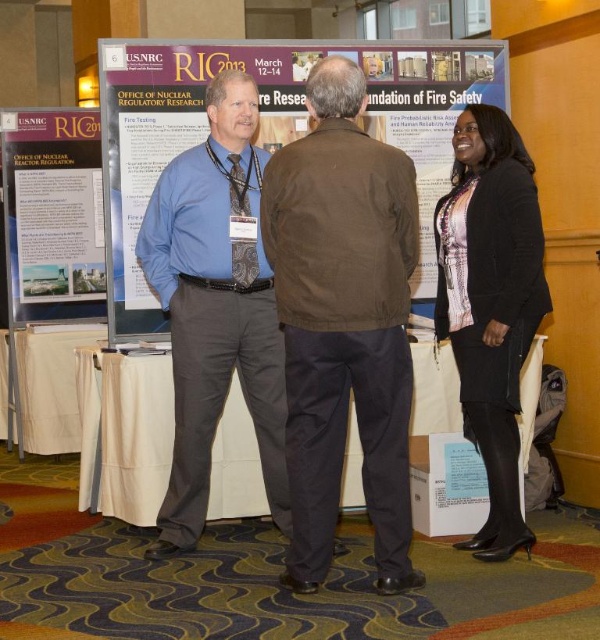
You are standing at the point labeled as point [208,380] in the conference room. You want to reach the exit door located at the opposite side of the room. Considering your height is 1.75 meters, will you be able to see the exit door over the heads of the three people in the foreground who are blocking your view?

The point labeled as point [208,380] is 3.68 meters away from the viewer. Since the three people in the foreground are engaged in conversation and their height is not specified, it is uncertain whether their heads will block the view to the exit door. However, given the distance, there might be a line of sight if they are not standing directly in front of the exit.

You are a photographer at the conference and want to take a group photo of the matte blue shirt at center and the black woolen coat at right. Considering their heights, which person should stand in the front row to ensure both are visible?

The black woolen coat at right should stand in the front row because the matte blue shirt at center is taller, allowing the shorter individual to be visible in front without blocking the view.

You are attending the RIC 2013 conference and want to read the matte paper poster at left. There is a brown leather jacket at center blocking your view. Based on their positions, can you move to the left or right to see the poster better?

The brown leather jacket at center is positioned on the right side of the matte paper poster at left. To see the poster better, you should move to the left side of the brown leather jacket at center, which would allow you to view the matte paper poster at left unobstructed.